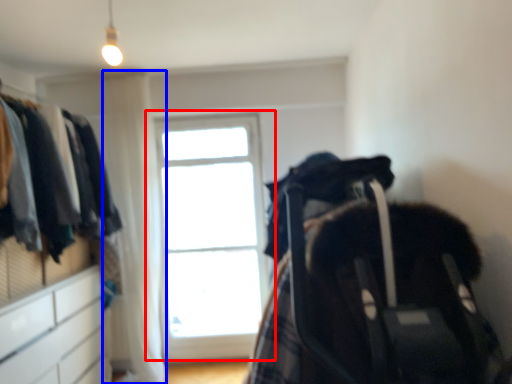
Question: Among these objects, which one is nearest to the camera, window (highlighted by a red box) or curtain (highlighted by a blue box)?

Choices:
 (A) window
 (B) curtain

Answer: (B)